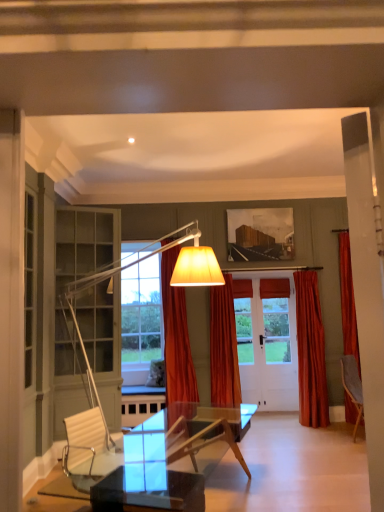
Question: Which direction should I rotate to look at orange velvet curtain at center, the second curtain when ordered from right to left?

Choices:
 (A) left
 (B) right

Answer: (B)

Question: Considering the relative sizes of velvet orange curtain at right, the 3th curtain positioned from the left, and orange velvet curtain at center, the first curtain from the left, in the image provided, is velvet orange curtain at right, the 3th curtain positioned from the left, wider than orange velvet curtain at center, the first curtain from the left,?

Choices:
 (A) yes
 (B) no

Answer: (B)

Question: Can you confirm if velvet orange curtain at right, the 1th curtain viewed from the right, is positioned to the left of orange velvet curtain at center, marked as the third curtain in a right-to-left arrangement?

Choices:
 (A) no
 (B) yes

Answer: (A)

Question: Can you confirm if velvet orange curtain at right, the 3th curtain positioned from the left, is bigger than orange velvet curtain at center, marked as the third curtain in a right-to-left arrangement?

Choices:
 (A) no
 (B) yes

Answer: (A)

Question: Is velvet orange curtain at right, the 3th curtain positioned from the left, shorter than orange velvet curtain at center, marked as the third curtain in a right-to-left arrangement?

Choices:
 (A) no
 (B) yes

Answer: (B)

Question: Is velvet orange curtain at right, the 1th curtain viewed from the right, aimed at orange velvet curtain at center, the first curtain from the left?

Choices:
 (A) no
 (B) yes

Answer: (A)

Question: Is velvet orange curtain at right, the 1th curtain viewed from the right, in front of orange velvet curtain at center, marked as the third curtain in a right-to-left arrangement?

Choices:
 (A) no
 (B) yes

Answer: (A)

Question: From the image's perspective, is orange velvet curtain at center, the second curtain when ordered from right to left, on orange velvet curtain at center, marked as the third curtain in a right-to-left arrangement?

Choices:
 (A) no
 (B) yes

Answer: (A)

Question: Is orange velvet curtain at center, the second curtain when ordered from right to left, not near orange velvet curtain at center, marked as the third curtain in a right-to-left arrangement?

Choices:
 (A) yes
 (B) no

Answer: (B)

Question: Does orange velvet curtain at center, which ranks as the second curtain in left-to-right order, have a lesser height compared to orange velvet curtain at center, marked as the third curtain in a right-to-left arrangement?

Choices:
 (A) no
 (B) yes

Answer: (B)

Question: Is orange velvet curtain at center, the second curtain when ordered from right to left, bigger than orange velvet curtain at center, the first curtain from the left?

Choices:
 (A) no
 (B) yes

Answer: (A)

Question: From a real-world perspective, is orange velvet curtain at center, the second curtain when ordered from right to left, over orange velvet curtain at center, marked as the third curtain in a right-to-left arrangement?

Choices:
 (A) no
 (B) yes

Answer: (A)

Question: Does orange velvet curtain at center, the second curtain when ordered from right to left, appear on the right side of orange velvet curtain at center, marked as the third curtain in a right-to-left arrangement?

Choices:
 (A) no
 (B) yes

Answer: (B)

Question: Would you say orange velvet curtain at center, which ranks as the second curtain in left-to-right order, is part of velvet orange curtain at right, the 3th curtain positioned from the left,'s contents?

Choices:
 (A) yes
 (B) no

Answer: (B)